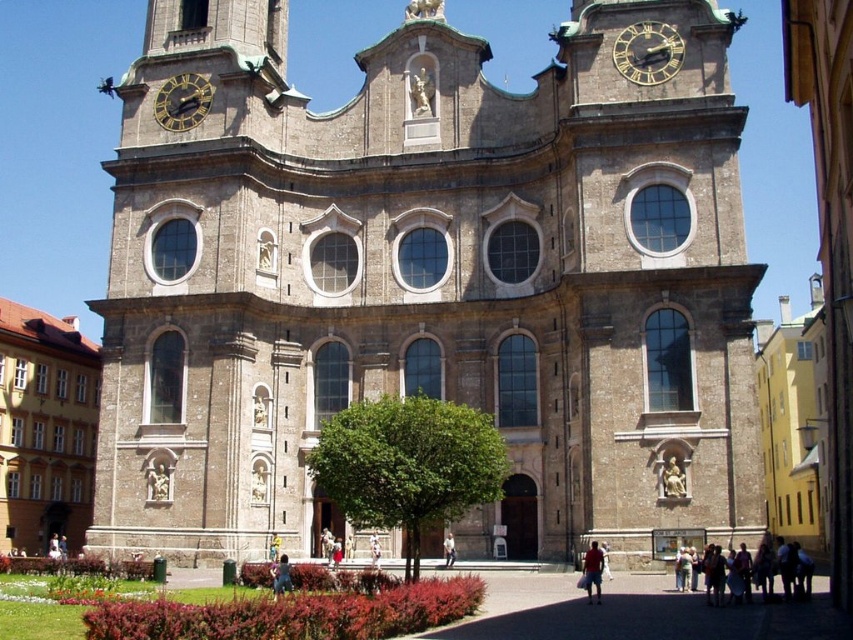
You are standing in front of the church and want to hang a new sign that is 1 meter wide between the gold metallic clock at upper center and the light brown leather jacket at center. Is there enough space?

The gold metallic clock at upper center might be wider than the light brown leather jacket at center, so there may not be enough space to hang a 1 meter wide sign between them.

You are standing in front of the church and want to locate both the brown stone tower at upper center and the goldmetallicclock at upper left. Which object is positioned to the right of the other?

The brown stone tower at upper center is to the right of the goldmetallicclock at upper left.